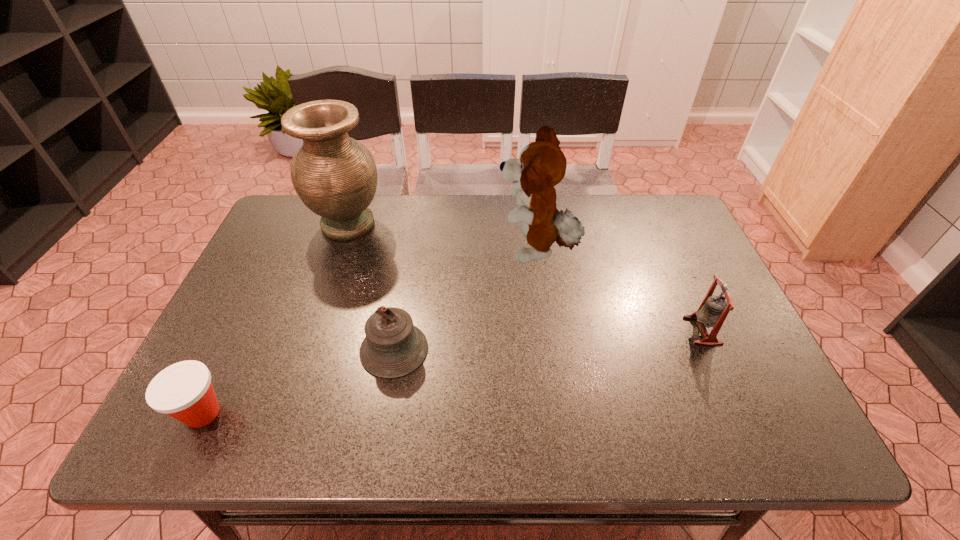
At what (x,y) coordinates should I click in order to perform the action: click on free location located 0.080m on the front of the right bell. Please return your answer as a coordinate pair (x, y). The height and width of the screenshot is (540, 960). Looking at the image, I should click on (724, 377).

Where is `vacant space situated on the left of the third object from left to right`? The height and width of the screenshot is (540, 960). vacant space situated on the left of the third object from left to right is located at coordinates (310, 349).

In order to click on vacant space located 0.260m on the back of the shortest object in this screenshot , I will do `click(256, 302)`.

Find the location of a particular element. vase that is at the far edge is located at coordinates (335, 176).

Locate an element on the screen. puppy that is at the far edge is located at coordinates (542, 165).

I want to click on object located at the near edge, so click(x=184, y=391).

Locate an element on the screen. The height and width of the screenshot is (540, 960). vase that is at the left edge is located at coordinates (335, 176).

I want to click on Dixie cup at the left edge, so click(x=184, y=391).

Where is `object at the right edge`? Image resolution: width=960 pixels, height=540 pixels. object at the right edge is located at coordinates (713, 310).

Locate an element on the screen. The height and width of the screenshot is (540, 960). object that is at the far left corner is located at coordinates (335, 176).